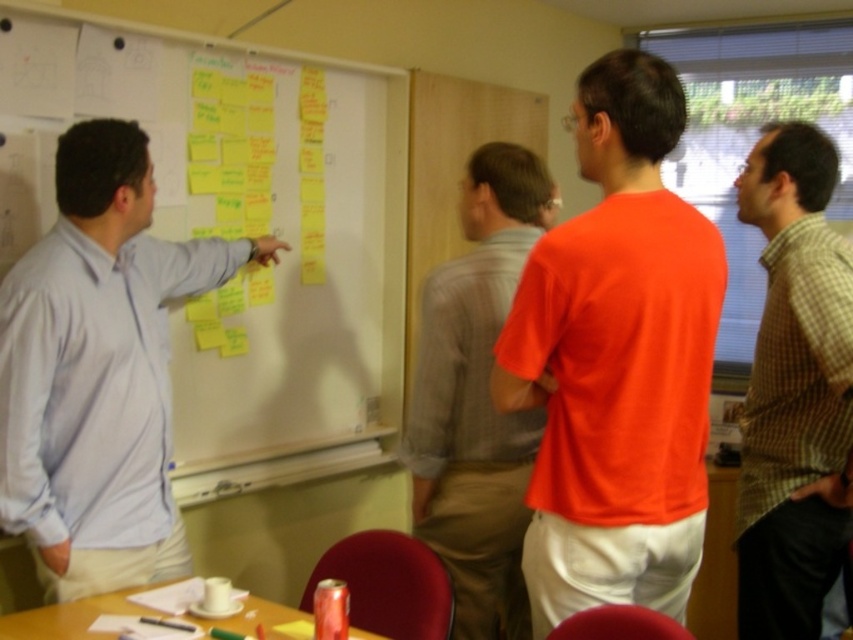
Which is more to the left, yellow sticky notes at upper left or orange t-shirt at center?

From the viewer's perspective, yellow sticky notes at upper left appears more on the left side.

How much distance is there between yellow sticky notes at upper left and orange t-shirt at center?

They are 29.53 inches apart.

Is point (286, 291) farther from viewer compared to point (502, 156)?

Yes, point (286, 291) is behind point (502, 156).

I want to click on yellow sticky notes at upper left, so click(x=238, y=228).

Does yellow sticky notes at upper left have a smaller size compared to green checkered shirt at right?

No.

This screenshot has width=853, height=640. What do you see at coordinates (238, 228) in the screenshot?
I see `yellow sticky notes at upper left` at bounding box center [238, 228].

Is point (218, 140) closer to viewer compared to point (792, 230)?

No, it is behind (792, 230).

The image size is (853, 640). I want to click on yellow sticky notes at upper left, so click(x=238, y=228).

Find the location of a particular element. The image size is (853, 640). light blue shirt at left is located at coordinates (97, 371).

This screenshot has width=853, height=640. What do you see at coordinates (97, 371) in the screenshot?
I see `light blue shirt at left` at bounding box center [97, 371].

Which is behind, point (160, 417) or point (490, 637)?

The point (490, 637) is more distant.

Where is `light blue shirt at left`? Image resolution: width=853 pixels, height=640 pixels. light blue shirt at left is located at coordinates (97, 371).